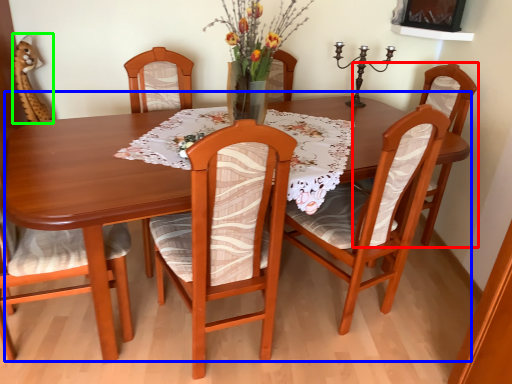
Question: Based on their relative distances, which object is nearer to chair (highlighted by a red box)? Choose from kitchen & dining room table (highlighted by a blue box) and armchair (highlighted by a green box).

Choices:
 (A) kitchen & dining room table
 (B) armchair

Answer: (A)